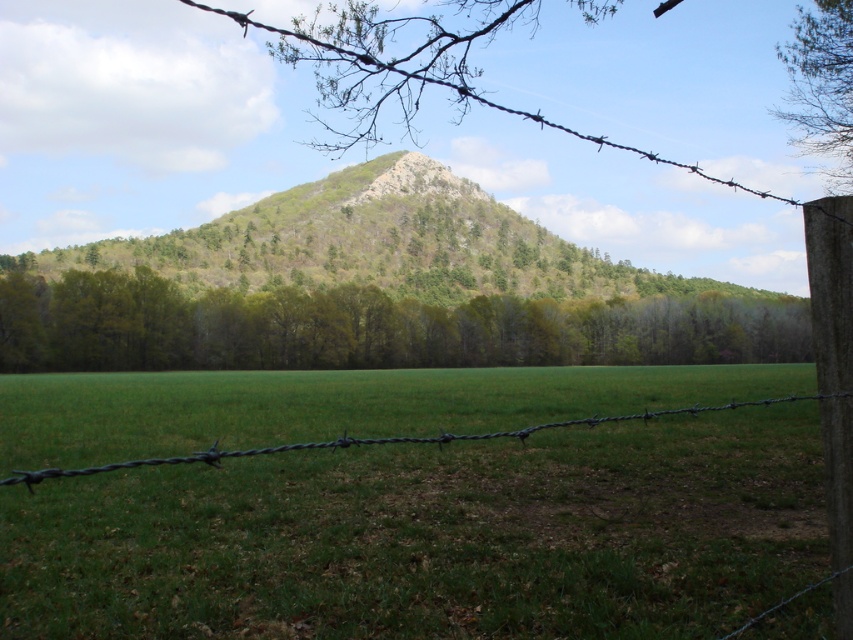
You are standing at the bottom of the hill and want to walk to the green grass at center. According to the coordinates provided, in which direction should you head?

The green grass at center is located at coordinates point (433, 538), so you should head towards the center of the image where the grass is located.

You are standing at the bottom of the hill and want to walk to the green grass at center represented by point (x=433, y=538). Which direction should you head?

You should head towards the bottom of the image because the green grass at center is located at point (x=433, y=538), which is in the lower part of the frame.

You are standing in front of the barbed wire fence in the rural landscape. You see two points marked on the fence. Which point is closer to you, point (55, 337) or point (161, 240)?

Point (55, 337) is closer to the viewer than point (161, 240).